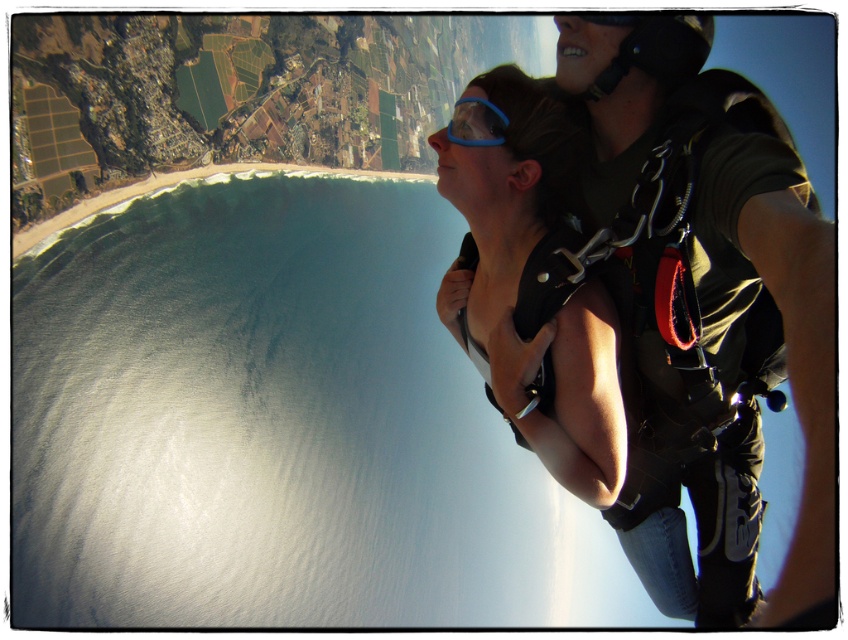
You are planning to take a photo of the skydiving experience. You want to ensure both the matte black harness at center and the blue rubber goggles at center are clearly visible. Based on their positions, which object should you focus on first to capture both in the frame?

The matte black harness at center is below the blue rubber goggles at center. To capture both in the frame, you should focus on the blue rubber goggles at center first, as it is higher up, allowing the harness to naturally fall into the lower part of the photo.

You are the student in the skydiving scene. You want to check if your harness is properly secured. Which object is closer to you, the matte black harness at center or the blue rubber goggles at center?

The matte black harness at center is closer to you because it is in front of the blue rubber goggles at center.